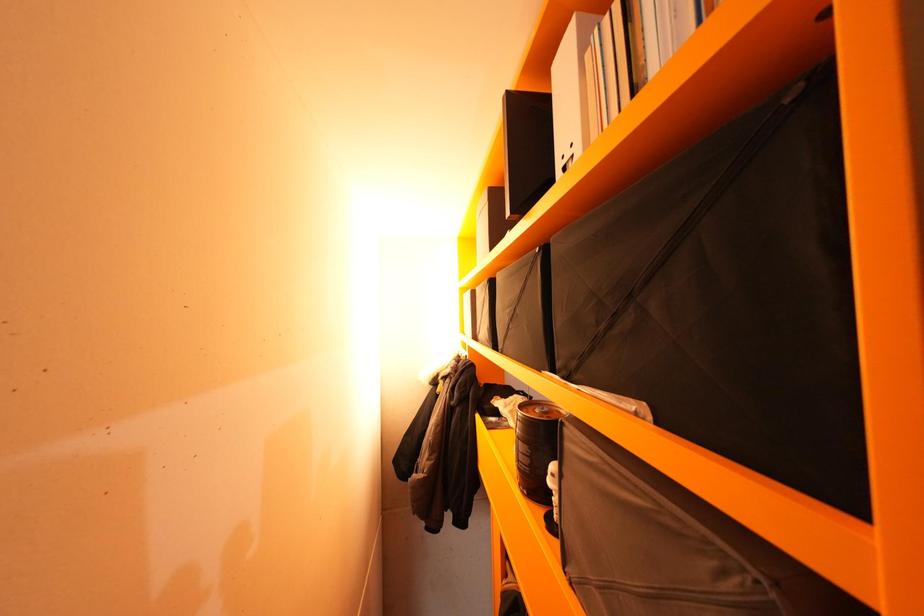
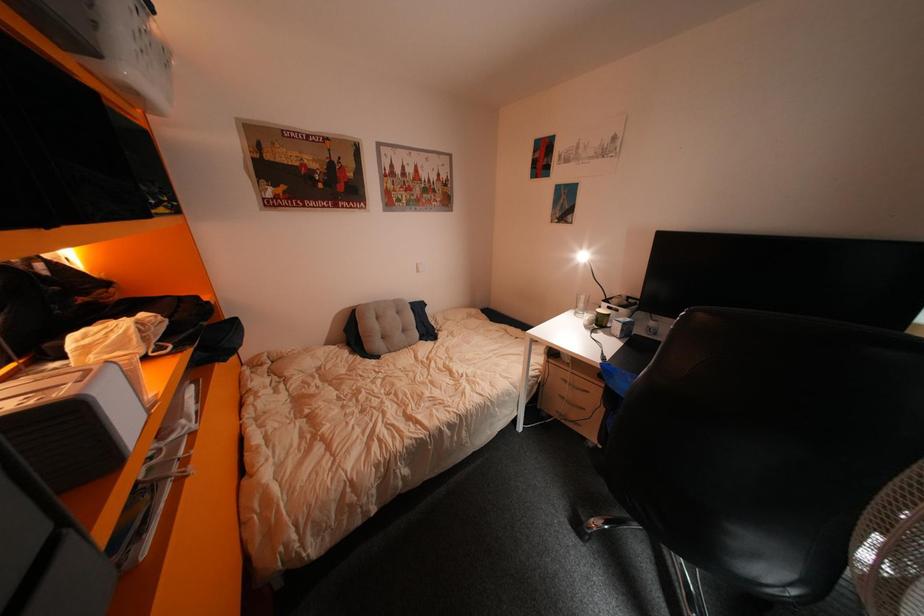
The images are taken continuously from a first-person perspective. In which direction is your viewpoint rotating?

The rotation direction of the camera is right-down.